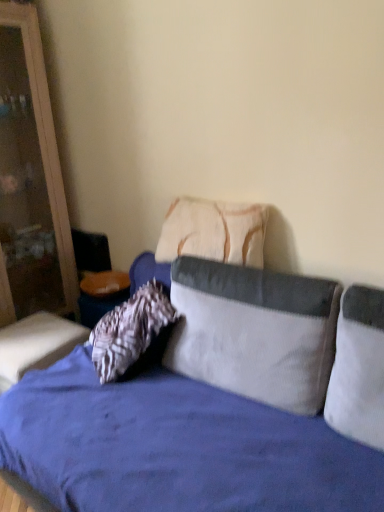
The image size is (384, 512). Describe the element at coordinates (358, 368) in the screenshot. I see `white corduroy pillow at right, the 1th pillow positioned from the front` at that location.

In order to click on white corduroy pillow at center, the second pillow when ordered from back to front in this screenshot , I will do pyautogui.click(x=254, y=332).

Looking at this image, in the image, is white corduroy pillow at right, the 3th pillow viewed from the back, on the left side or the right side of velvet blue studio couch at center?

In the image, white corduroy pillow at right, the 3th pillow viewed from the back, appears on the right side of velvet blue studio couch at center.

Can you confirm if white corduroy pillow at right, the 1th pillow positioned from the front, is wider than velvet blue studio couch at center?

No.

Is white corduroy pillow at right, the 3th pillow viewed from the back, situated inside velvet blue studio couch at center or outside?

white corduroy pillow at right, the 3th pillow viewed from the back, is located inside velvet blue studio couch at center.

Consider the image. Is white corduroy pillow at right, the 1th pillow positioned from the front, positioned far away from wooden dresser at left?

white corduroy pillow at right, the 1th pillow positioned from the front, is far away from wooden dresser at left.

How different are the orientations of white corduroy pillow at right, the 3th pillow viewed from the back, and wooden dresser at left in degrees?

94.5 degrees.

Based on the photo, in terms of size, does white corduroy pillow at right, the 1th pillow positioned from the front, appear bigger or smaller than wooden dresser at left?

Clearly, white corduroy pillow at right, the 1th pillow positioned from the front, is smaller in size than wooden dresser at left.

Considering the sizes of objects white corduroy pillow at right, the 3th pillow viewed from the back, and wooden dresser at left in the image provided, who is taller, white corduroy pillow at right, the 3th pillow viewed from the back, or wooden dresser at left?

wooden dresser at left.

Can you confirm if wooden dresser at left is bigger than white corduroy pillow at right, the 3th pillow viewed from the back?

Yes.

Do you think wooden dresser at left is within white corduroy pillow at right, the 1th pillow positioned from the front, or outside of it?

wooden dresser at left exists outside the volume of white corduroy pillow at right, the 1th pillow positioned from the front.

From a real-world perspective, does wooden dresser at left sit lower than white corduroy pillow at right, the 3th pillow viewed from the back?

Incorrect, from a real-world perspective, wooden dresser at left is higher than white corduroy pillow at right, the 3th pillow viewed from the back.

Based on the photo, from the image's perspective, is velvet cushion at lower left under white corduroy pillow at center, the second pillow when ordered from back to front?

Correct, velvet cushion at lower left appears lower than white corduroy pillow at center, the second pillow when ordered from back to front, in the image.

Is velvet cushion at lower left turned away from white corduroy pillow at center, the second pillow when ordered from back to front?

No, velvet cushion at lower left is not facing away from white corduroy pillow at center, the second pillow when ordered from back to front.

Is velvet cushion at lower left in contact with white corduroy pillow at center, the second pillow when ordered from back to front?

No, velvet cushion at lower left is not with white corduroy pillow at center, the second pillow when ordered from back to front.

In terms of height, does velvet cushion at lower left look taller or shorter compared to white corduroy pillow at center, the second pillow when ordered from back to front?

Clearly, velvet cushion at lower left is shorter compared to white corduroy pillow at center, the second pillow when ordered from back to front.

Is white corduroy pillow at center, acting as the 2th pillow starting from the front, positioned far away from textured beige pillow at center, which appears as the first pillow when viewed from the back?

Actually, white corduroy pillow at center, acting as the 2th pillow starting from the front, and textured beige pillow at center, which appears as the first pillow when viewed from the back, are a little close together.

From a real-world perspective, which is physically above, white corduroy pillow at center, the second pillow when ordered from back to front, or textured beige pillow at center, which appears as the first pillow when viewed from the back?

In real-world perspective, textured beige pillow at center, which appears as the first pillow when viewed from the back, is above.

Which is closer to the camera, (176, 305) or (236, 254)?

Point (176, 305) is positioned closer to the camera compared to point (236, 254).

Between white corduroy pillow at center, acting as the 2th pillow starting from the front, and textured beige pillow at center, which appears as the first pillow when viewed from the back, which one appears on the right side from the viewer's perspective?

white corduroy pillow at center, acting as the 2th pillow starting from the front, is more to the right.

What's the angular difference between white corduroy pillow at right, the 1th pillow positioned from the front, and textured beige pillow at center, placed as the 3th pillow when sorted from front to back,'s facing directions?

The angle between the facing direction of white corduroy pillow at right, the 1th pillow positioned from the front, and the facing direction of textured beige pillow at center, placed as the 3th pillow when sorted from front to back, is 8.25 degrees.

Looking at this image, is white corduroy pillow at right, the 3th pillow viewed from the back, inside the boundaries of textured beige pillow at center, placed as the 3th pillow when sorted from front to back, or outside?

white corduroy pillow at right, the 3th pillow viewed from the back, is not inside textured beige pillow at center, placed as the 3th pillow when sorted from front to back, it's outside.

Does white corduroy pillow at right, the 1th pillow positioned from the front, come behind textured beige pillow at center, placed as the 3th pillow when sorted from front to back?

No, the depth of white corduroy pillow at right, the 1th pillow positioned from the front, is less than that of textured beige pillow at center, placed as the 3th pillow when sorted from front to back.

At what (x,y) coordinates should I click in order to perform the action: click on pillow that appears above the white corduroy pillow at right, the 3th pillow viewed from the back (from a real-world perspective). Please return your answer as a coordinate pair (x, y). The height and width of the screenshot is (512, 384). Looking at the image, I should click on (214, 232).

Does velvet cushion at lower left have a smaller size compared to velvet blue studio couch at center?

Yes.

Considering the positions of objects velvet cushion at lower left and velvet blue studio couch at center in the image provided, who is in front, velvet cushion at lower left or velvet blue studio couch at center?

Positioned in front is velvet blue studio couch at center.

Which point is more distant from viewer, (71,326) or (136,274)?

The point (71,326) is behind.

Where is `studio couch located in front of the white corduroy pillow at right, the 3th pillow viewed from the back`? studio couch located in front of the white corduroy pillow at right, the 3th pillow viewed from the back is located at coordinates (142, 269).

The height and width of the screenshot is (512, 384). I want to click on dresser located behind the white corduroy pillow at right, the 3th pillow viewed from the back, so click(31, 180).

Looking at the image, which one is located closer to white corduroy pillow at right, the 1th pillow positioned from the front, white corduroy pillow at center, the second pillow when ordered from back to front, or velvet cushion at lower left?

white corduroy pillow at center, the second pillow when ordered from back to front, lies closer to white corduroy pillow at right, the 1th pillow positioned from the front, than the other object.

Considering their positions, is white corduroy pillow at center, acting as the 2th pillow starting from the front, positioned further to wooden dresser at left than white corduroy pillow at right, the 3th pillow viewed from the back?

The object further to wooden dresser at left is white corduroy pillow at right, the 3th pillow viewed from the back.

Looking at the image, which one is located further to white corduroy pillow at center, acting as the 2th pillow starting from the front, white corduroy pillow at right, the 1th pillow positioned from the front, or velvet cushion at lower left?

velvet cushion at lower left is further to white corduroy pillow at center, acting as the 2th pillow starting from the front.

Looking at the image, which one is located further to textured beige pillow at center, which appears as the first pillow when viewed from the back, white corduroy pillow at center, the second pillow when ordered from back to front, or velvet blue studio couch at center?

velvet blue studio couch at center.

When comparing their distances from white corduroy pillow at center, acting as the 2th pillow starting from the front, does velvet cushion at lower left or white corduroy pillow at right, the 1th pillow positioned from the front, seem closer?

white corduroy pillow at right, the 1th pillow positioned from the front, lies closer to white corduroy pillow at center, acting as the 2th pillow starting from the front, than the other object.

From the image, which object appears to be farther from white corduroy pillow at right, the 1th pillow positioned from the front, wooden dresser at left or velvet cushion at lower left?

Among the two, wooden dresser at left is located further to white corduroy pillow at right, the 1th pillow positioned from the front.

Based on their spatial positions, is white corduroy pillow at center, the second pillow when ordered from back to front, or velvet blue studio couch at center further from white corduroy pillow at right, the 1th pillow positioned from the front?

velvet blue studio couch at center.

From the picture: Considering their positions, is wooden dresser at left positioned closer to velvet cushion at lower left than textured beige pillow at center, placed as the 3th pillow when sorted from front to back?

Among the two, wooden dresser at left is located nearer to velvet cushion at lower left.

At what (x,y) coordinates should I click in order to perform the action: click on table located between wooden dresser at left and white corduroy pillow at center, acting as the 2th pillow starting from the front, in the left-right direction. Please return your answer as a coordinate pair (x, y). Looking at the image, I should click on (36, 344).

Identify the location of table situated between wooden dresser at left and textured beige pillow at center, which appears as the first pillow when viewed from the back, from left to right. (36, 344).

The height and width of the screenshot is (512, 384). I want to click on studio couch between wooden dresser at left and white corduroy pillow at right, the 3th pillow viewed from the back, in the horizontal direction, so click(x=142, y=269).

Identify the location of studio couch located between velvet cushion at lower left and white corduroy pillow at right, the 3th pillow viewed from the back, in the left-right direction. (142, 269).